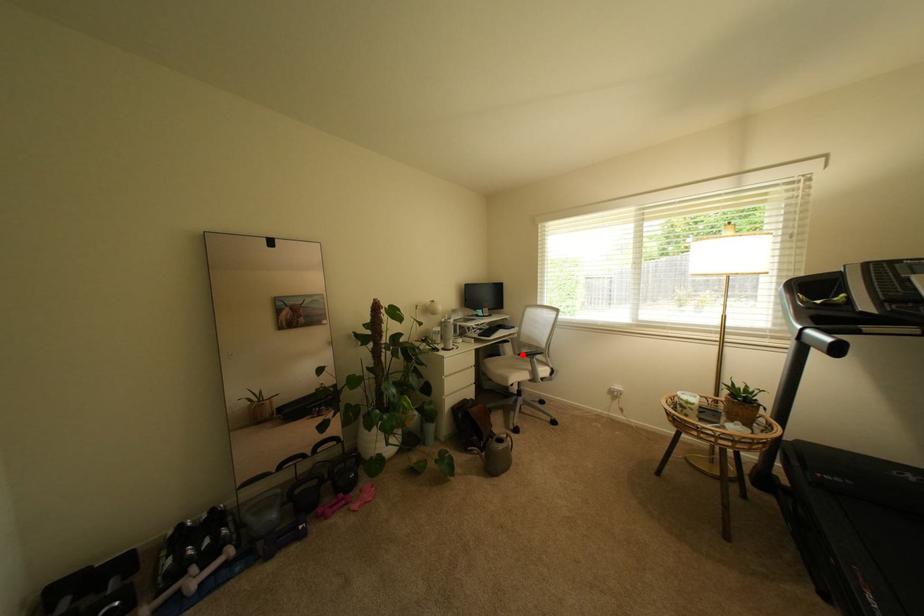
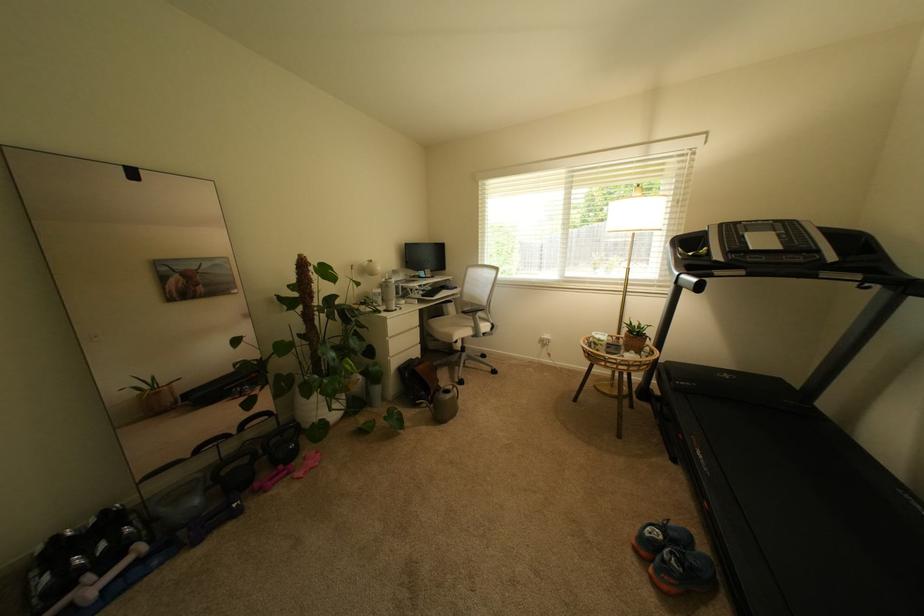
Find the pixel in the second image that matches the highlighted location in the first image.

(466, 314)